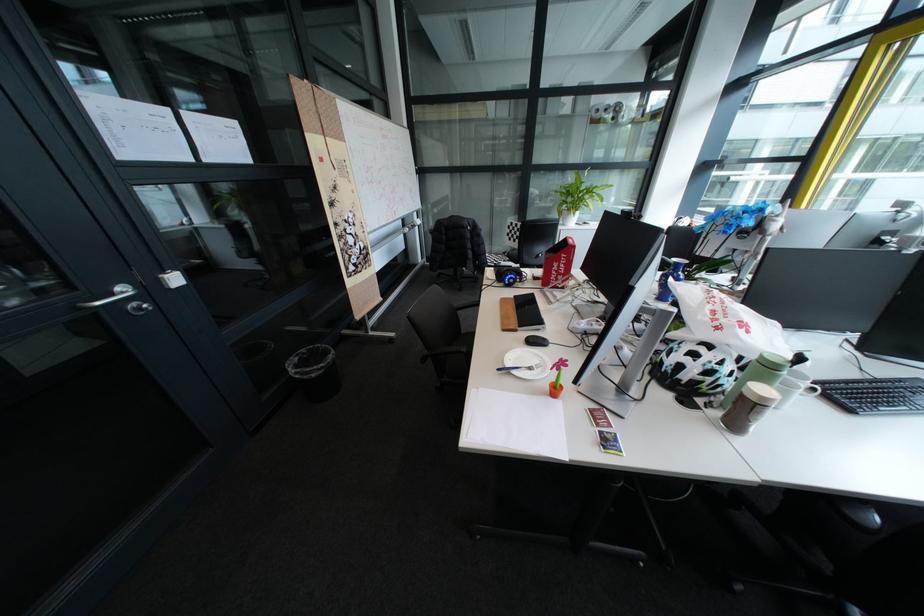
The image size is (924, 616). I want to click on white mug handle, so click(812, 389).